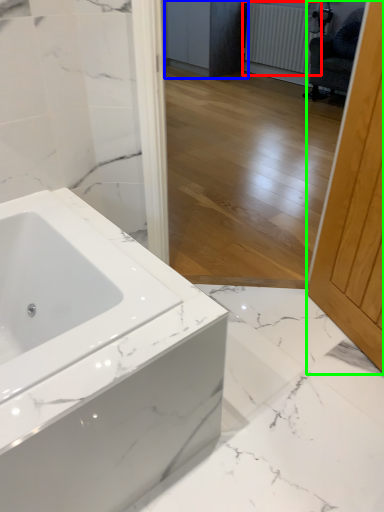
Question: Which object is positioned closest to radiator (highlighted by a red box)? Select from cabinetry (highlighted by a blue box) and screen door (highlighted by a green box).

Choices:
 (A) cabinetry
 (B) screen door

Answer: (A)